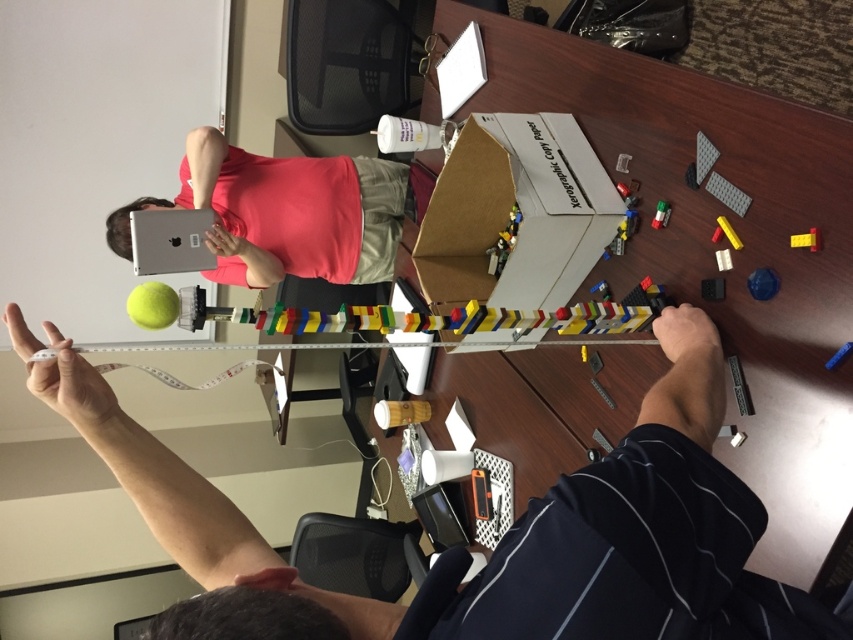
Can you confirm if matte black tape measure at upper left is positioned to the left of blue matte block at center?

Indeed, matte black tape measure at upper left is positioned on the left side of blue matte block at center.

Does matte black tape measure at upper left appear on the right side of blue matte block at center?

No, matte black tape measure at upper left is not to the right of blue matte block at center.

Locate an element on the screen. Image resolution: width=853 pixels, height=640 pixels. matte black tape measure at upper left is located at coordinates (498, 541).

Is point (515, 628) farther from camera compared to point (741, 243)?

No, (515, 628) is closer to viewer.

Which is more to the left, matte black tape measure at upper left or yellow matte marker at upper right?

matte black tape measure at upper left

Which is in front, point (521, 554) or point (734, 248)?

Point (521, 554)

Find the location of a particular element. This screenshot has width=853, height=640. matte black tape measure at upper left is located at coordinates (498, 541).

Is yellow matte brick at upper right below green matte lego at center?

Yes.

You are a GUI agent. You are given a task and a screenshot of the screen. Output one action in this format:
    pyautogui.click(x=<x>, y=<y>)
    Task: Click on the yellow matte brick at upper right
    
    Given the screenshot: What is the action you would take?
    pyautogui.click(x=805, y=240)

This screenshot has width=853, height=640. What are the coordinates of `yellow matte brick at upper right` in the screenshot? It's located at (805, 240).